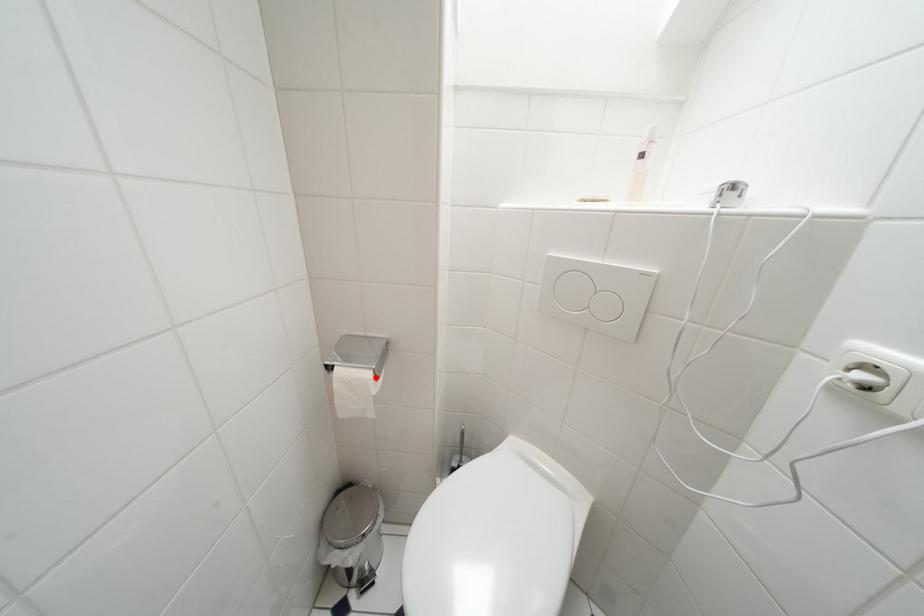
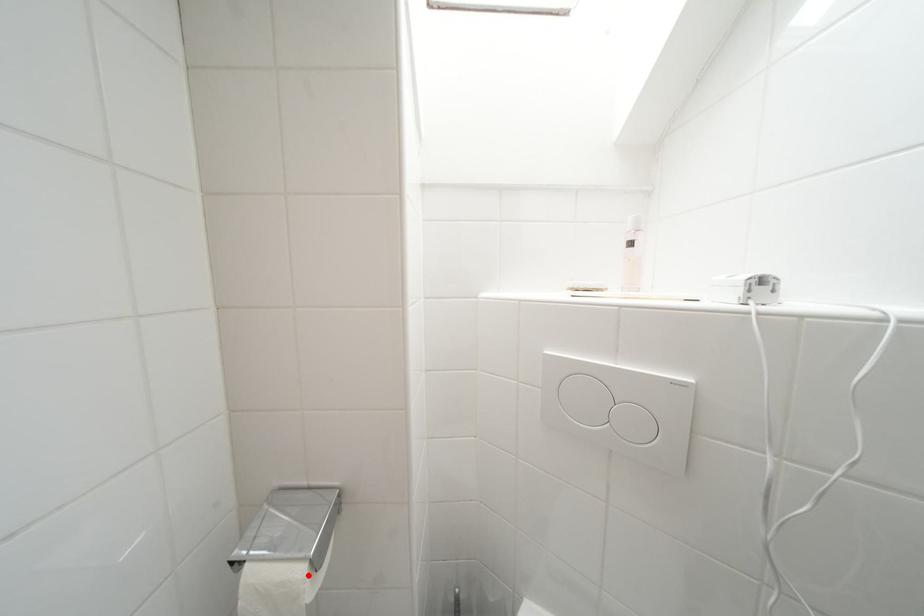
I am providing you with two images of the same scene from different viewpoints. A red point is marked on the first image and another point is marked on the second image. Is the marked point in image1 the same physical position as the marked point in image2?

Yes